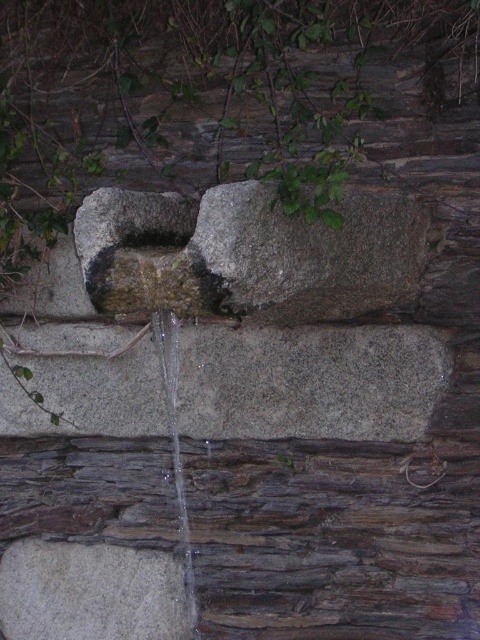
Does gray stone at center have a larger size compared to clear glass water at lower center?

Indeed, gray stone at center has a larger size compared to clear glass water at lower center.

Is gray stone at center to the left of clear glass water at lower center from the viewer's perspective?

In fact, gray stone at center is to the right of clear glass water at lower center.

Is point (256, 406) closer to viewer compared to point (172, 467)?

That is True.

Find the location of a particular element. gray stone at center is located at coordinates (310, 381).

Is gray stone at center shorter than gray rough stone at lower left?

No.

I want to click on gray stone at center, so click(x=310, y=381).

Is gray rough stone at center closer to the viewer compared to gray rough stone at lower left?

Yes, it is in front of gray rough stone at lower left.

Does gray rough stone at center appear under gray rough stone at lower left?

Actually, gray rough stone at center is above gray rough stone at lower left.

You are a GUI agent. You are given a task and a screenshot of the screen. Output one action in this format:
    pyautogui.click(x=<x>, y=<y>)
    Task: Click on the gray rough stone at center
    The image size is (480, 640).
    Given the screenshot: What is the action you would take?
    pyautogui.click(x=308, y=253)